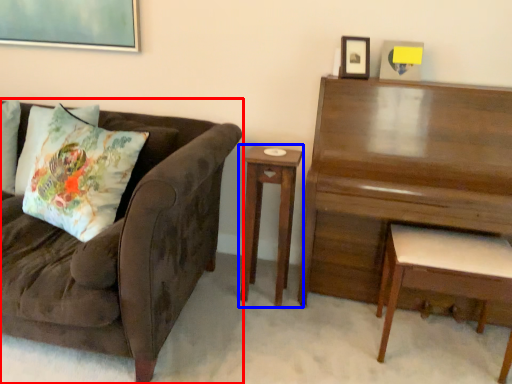
Question: Which object is closer to the camera taking this photo, studio couch (highlighted by a red box) or nightstand (highlighted by a blue box)?

Choices:
 (A) studio couch
 (B) nightstand

Answer: (A)